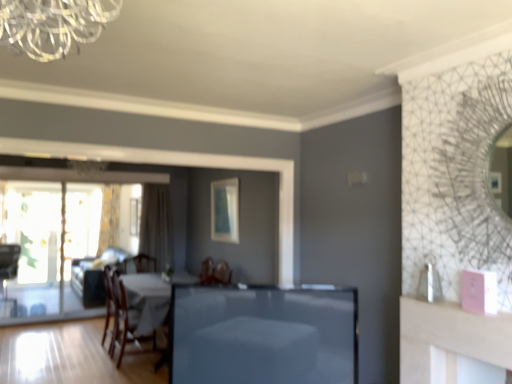
Image resolution: width=512 pixels, height=384 pixels. Find the location of `vacant point above matte blue picture frame at center, the 1th picture frame when ordered from right to left (from a real-world perspective)`. vacant point above matte blue picture frame at center, the 1th picture frame when ordered from right to left (from a real-world perspective) is located at coordinates (223, 175).